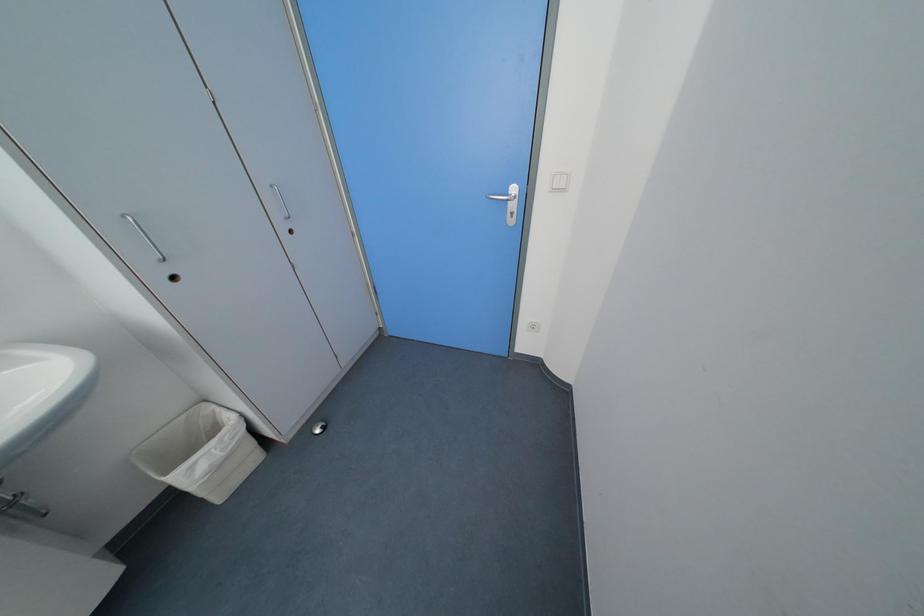
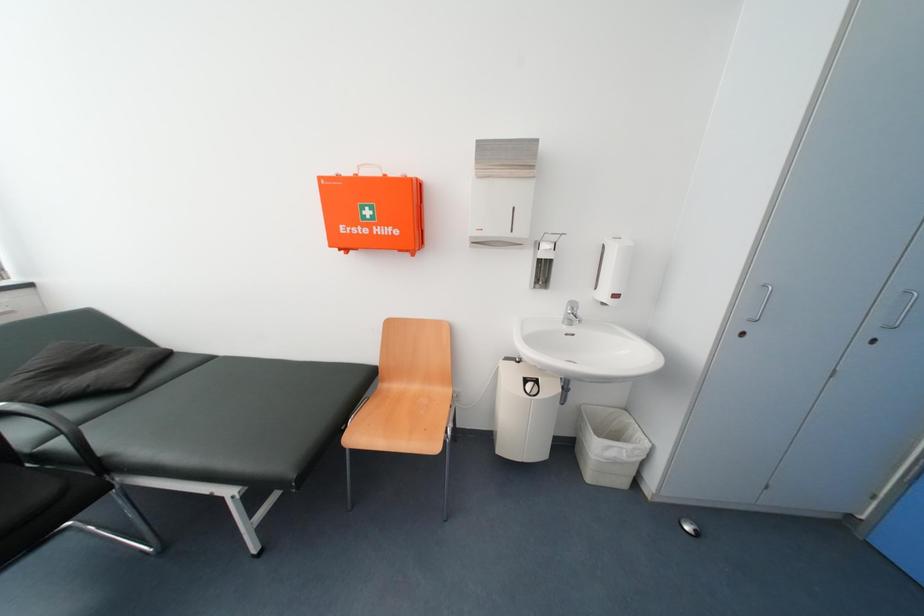
Question: The camera is either moving clockwise (left) or counter-clockwise (right) around the object. The first image is from the beginning of the video and the second image is from the end. Is the camera moving left or right when shooting the video?

Choices:
 (A) Left
 (B) Right

Answer: (B)